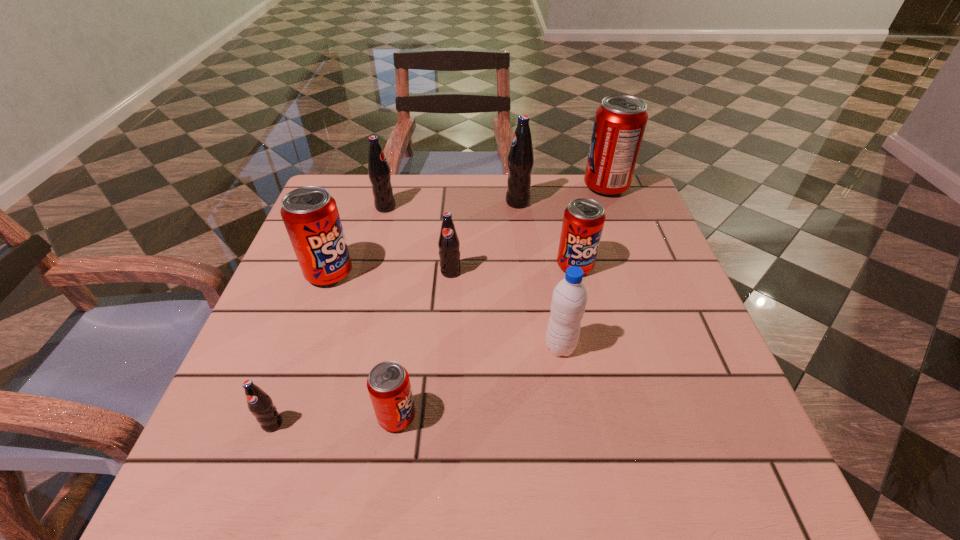
Locate an element on the screen. The image size is (960, 540). object situated at the far right corner is located at coordinates (620, 121).

Identify the location of vacant space at the far edge of the desktop. (514, 214).

Where is `vacant space at the near edge`? vacant space at the near edge is located at coordinates (414, 443).

This screenshot has height=540, width=960. In the image, there is a desktop. In order to click on free space at the left edge in this screenshot , I will do `click(302, 301)`.

This screenshot has width=960, height=540. In order to click on free space at the right edge in this screenshot , I will do `click(636, 377)`.

I want to click on free location at the far left corner of the desktop, so click(358, 219).

The width and height of the screenshot is (960, 540). I want to click on vacant region at the far right corner, so click(628, 201).

This screenshot has height=540, width=960. In the image, there is a desktop. Identify the location of free space at the near right corner. (736, 437).

Identify the location of free space between the second smallest red soda can and the nearest black pop. (423, 345).

Image resolution: width=960 pixels, height=540 pixels. Find the location of `unoccupied position between the third smallest black pop and the second nearest black pop`. unoccupied position between the third smallest black pop and the second nearest black pop is located at coordinates (418, 240).